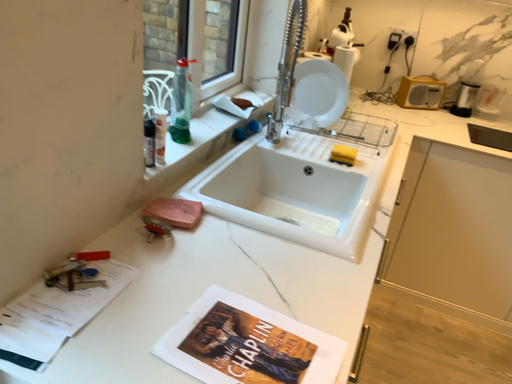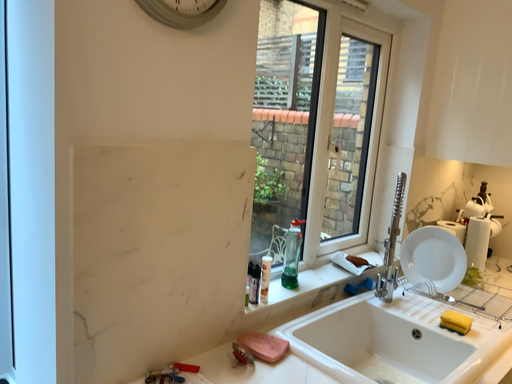
Question: Which way did the camera rotate in the video?

Choices:
 (A) rotated upward
 (B) rotated downward

Answer: (A)